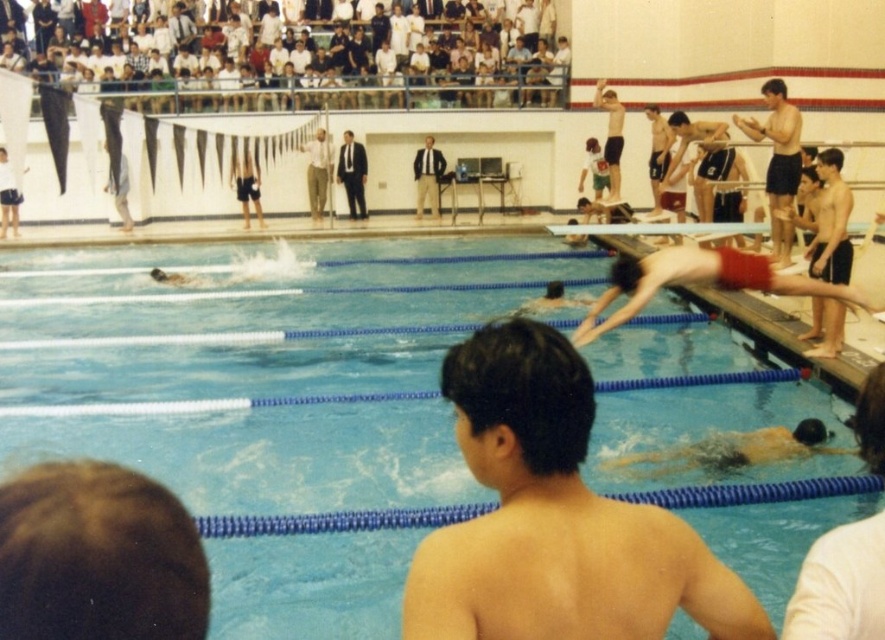
In the scene shown: You are a lifeguard standing at the edge of the blue rubber pool at center. You notice the smooth skin diver at upper center is struggling. Can you reach them before they drift further into the pool?

The blue rubber pool at center is in front of the smooth skin diver at upper center, meaning the diver is closer to the edge of the pool. As a lifeguard, you can reach them before they drift further into the pool.

A lifeguard needs to reach the swimmer at point (745, 125) and the spectator at point 0.802, 0.156 as quickly as possible. If the lifeguard can move at 15 feet per second on the deck and 3 feet per second in the water, which path should they take to minimize response time?

The lifeguard should choose the path that minimizes the distance in water since they move slower there. The optimal path would involve moving mostly on the deck and entering the water as close as possible to the point (745, 125), but since both points are in different areas, the exact calculation requires knowing their positions relative to land and water. However, given the 39.99 feet separation, the lifeguard should prioritize the shortest overall path considering speeds.

You are a lifeguard observing the pool area. You notice two people wearing light brown cotton pants at center and smooth black shorts at upper right. Which one is standing closer to the edge of the pool?

The light brown cotton pants at center is much taller as smooth black shorts at upper right, so the person in light brown cotton pants at center is standing closer to the edge of the pool because taller objects are typically positioned closer to the edge for visibility during events.